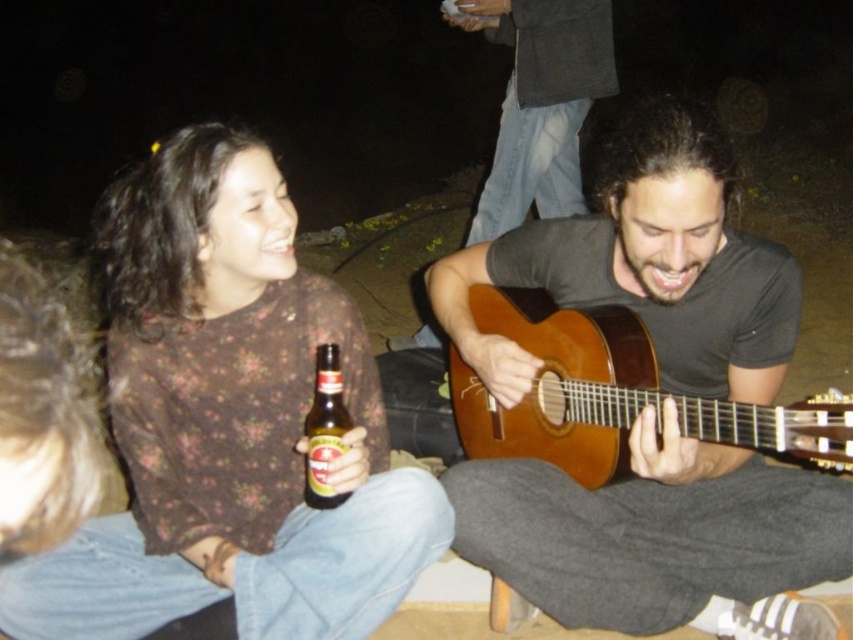
In the scene shown: You are a photographer at the event and want to capture both the matte brown guitar at center and the brown glass bottle at lower left in the same frame. Since the camera can only focus on one object at a time, which object should you focus on to ensure it appears larger in the photo?

The matte brown guitar at center is taller than the brown glass bottle at lower left, so focusing on the matte brown guitar at center will make it appear larger in the photo.

You are a photographer at this night gathering. You want to take a photo that includes both the brown floral shirt at upper left and the matte brown guitar at center. Which object should be placed on the left side of the photo to ensure both are in frame?

The brown floral shirt at upper left should be placed on the left side of the photo since it is already positioned to the left of the matte brown guitar at center in the scene.